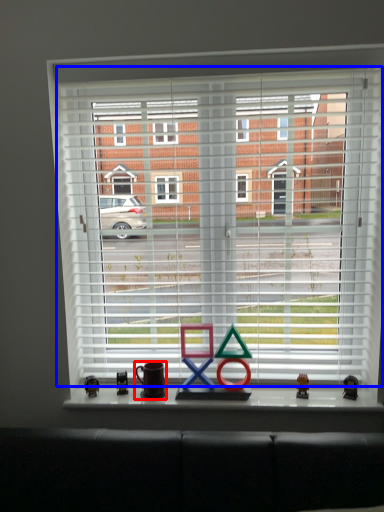
Question: Which of the following is the closest to the observer, mug (highlighted by a red box) or window blind (highlighted by a blue box)?

Choices:
 (A) mug
 (B) window blind

Answer: (B)